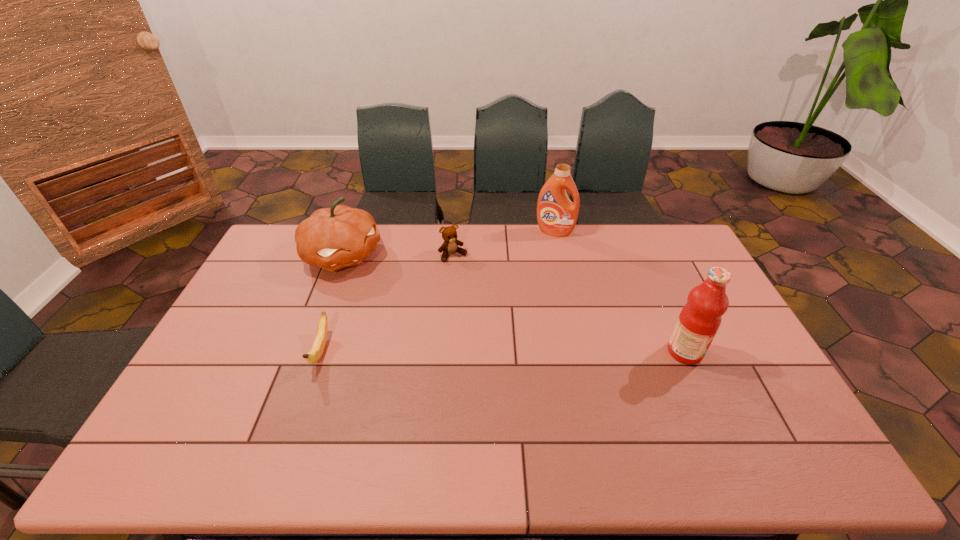
Identify the location of free spot on the desktop that is between the shortest object and the fruit juice and is positioned on the front-facing side of the third object from left to right. Image resolution: width=960 pixels, height=540 pixels. (523, 352).

Locate an element on the screen. Image resolution: width=960 pixels, height=540 pixels. vacant space on the desktop that is between the shortest object and the rightmost object and is positioned on the front-facing side of the detergent is located at coordinates (510, 352).

Identify the location of vacant spot on the desktop that is between the shortest object and the rightmost object and is positioned on the front face of the pumpkin. The height and width of the screenshot is (540, 960). (460, 352).